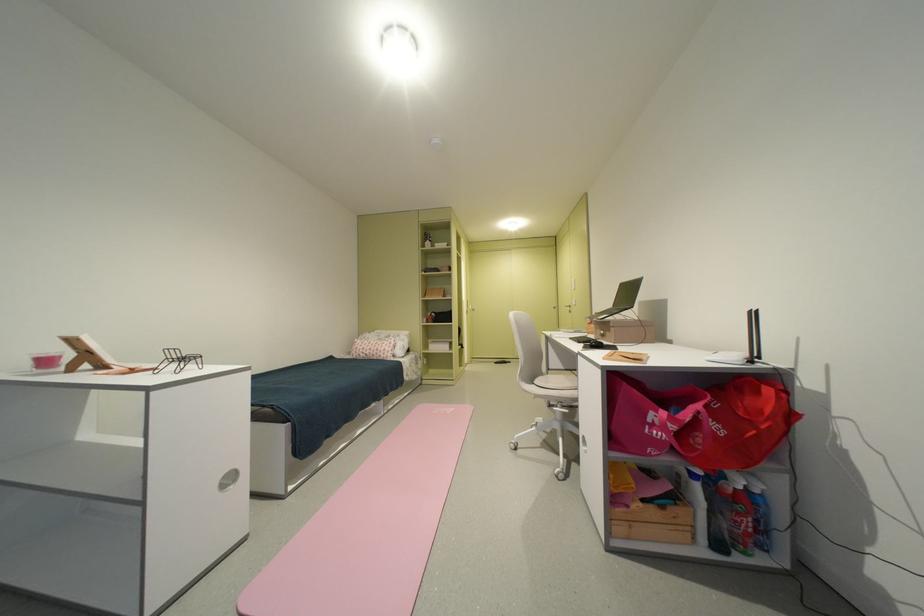
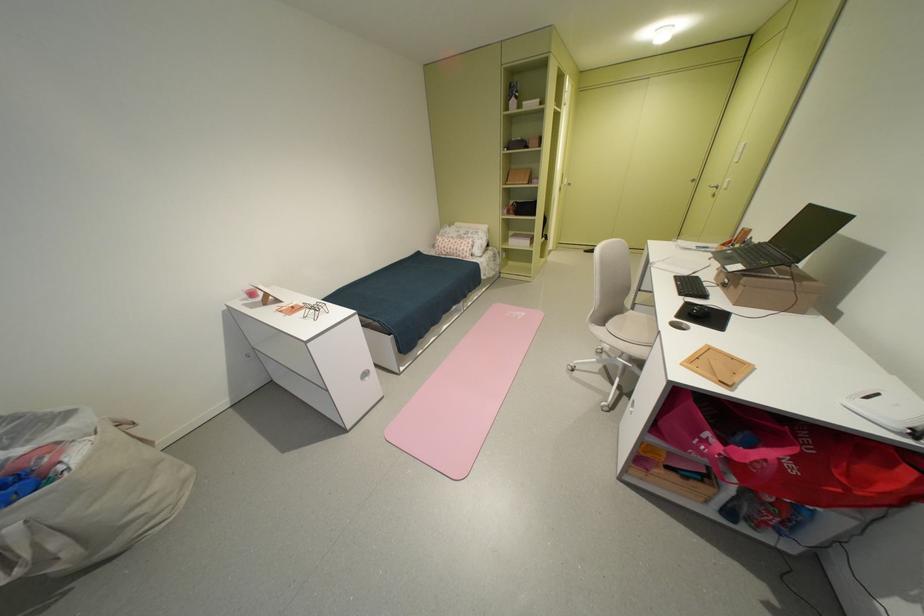
In the second image, find the point that corresponds to (618,331) in the first image.

(746, 288)